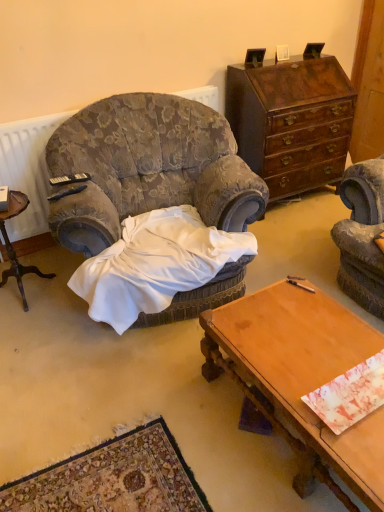
At what (x,y) coordinates should I click in order to perform the action: click on vacant space situated on the left part of wooden desk at lower right. Please return your answer as a coordinate pair (x, y). This screenshot has width=384, height=512. Looking at the image, I should click on (x=163, y=428).